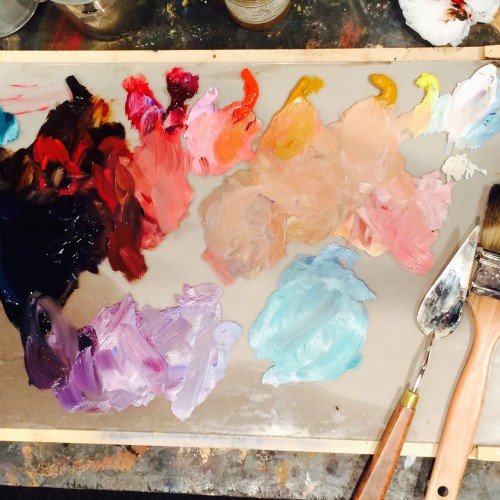
Where is `white paint`? This screenshot has width=500, height=500. white paint is located at coordinates (465, 105).